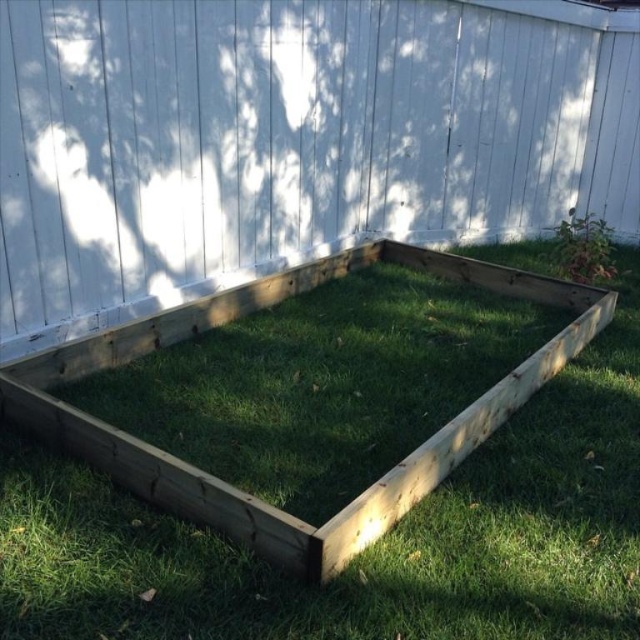
You are a gardener who needs to water both the natural wood fence at center and the green grass at center. If your watering can holds enough water to cover 4 meters, can you water both without refilling?

The distance between the natural wood fence at center and green grass at center is 3.64 meters. Since your watering can can cover 4 meters, you can water both without needing to refill.

You are standing in the garden and see the point marked at coordinates (291, 140). What is located at that point?

The point at coordinates (291, 140) marks the natural wood fence at center.